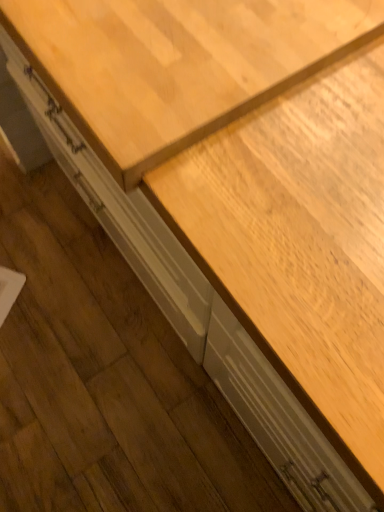
This screenshot has height=512, width=384. What do you see at coordinates (176, 64) in the screenshot?
I see `natural wood vanity at upper center` at bounding box center [176, 64].

Where is `natural wood vanity at upper center`? natural wood vanity at upper center is located at coordinates (176, 64).

Locate an element on the screen. This screenshot has width=384, height=512. natural wood vanity at upper center is located at coordinates (176, 64).